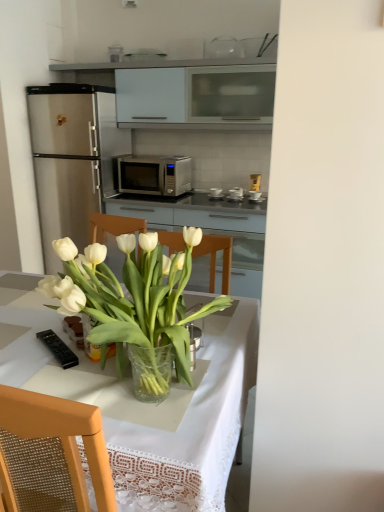
Question: Is black plastic remote control at lower left, which ranks as the 2th appliance in back-to-front order, not close to satin silver microwave at center?

Choices:
 (A) yes
 (B) no

Answer: (A)

Question: Is black plastic remote control at lower left, which ranks as the first appliance in front-to-back order, not within satin silver microwave at center?

Choices:
 (A) yes
 (B) no

Answer: (A)

Question: Can you confirm if black plastic remote control at lower left, acting as the 1th appliance starting from the bottom, is thinner than satin silver microwave at center?

Choices:
 (A) yes
 (B) no

Answer: (A)

Question: Does black plastic remote control at lower left, acting as the second appliance starting from the right, have a smaller size compared to satin silver microwave at center?

Choices:
 (A) no
 (B) yes

Answer: (B)

Question: Considering the relative sizes of black plastic remote control at lower left, which ranks as the first appliance in front-to-back order, and satin silver microwave at center in the image provided, is black plastic remote control at lower left, which ranks as the first appliance in front-to-back order, shorter than satin silver microwave at center?

Choices:
 (A) yes
 (B) no

Answer: (A)

Question: In terms of width, does white matte cabinet at upper center look wider or thinner when compared to metallic silver toaster at center, placed as the first appliance when sorted from back to front?

Choices:
 (A) thin
 (B) wide

Answer: (B)

Question: From a real-world perspective, is white matte cabinet at upper center above or below metallic silver toaster at center, the 1th appliance in the right-to-left sequence?

Choices:
 (A) above
 (B) below

Answer: (A)

Question: In terms of size, does white matte cabinet at upper center appear bigger or smaller than metallic silver toaster at center, arranged as the 1th appliance when viewed from the top?

Choices:
 (A) big
 (B) small

Answer: (A)

Question: Is point (117, 108) closer or farther from the camera than point (236, 188)?

Choices:
 (A) farther
 (B) closer

Answer: (B)

Question: In terms of height, does metallic silver toaster at center, arranged as the second appliance when viewed from the front, look taller or shorter compared to translucent glass vase at center?

Choices:
 (A) tall
 (B) short

Answer: (B)

Question: From a real-world perspective, is metallic silver toaster at center, placed as the first appliance when sorted from back to front, above or below translucent glass vase at center?

Choices:
 (A) below
 (B) above

Answer: (A)

Question: In the image, is metallic silver toaster at center, positioned as the 2th appliance in bottom-to-top order, positioned in front of or behind translucent glass vase at center?

Choices:
 (A) behind
 (B) front

Answer: (A)

Question: Considering the positions of point (236, 187) and point (61, 291), is point (236, 187) closer or farther from the camera than point (61, 291)?

Choices:
 (A) closer
 (B) farther

Answer: (B)

Question: Is point (67, 355) positioned closer to the camera than point (99, 327)?

Choices:
 (A) farther
 (B) closer

Answer: (A)

Question: Is black plastic remote control at lower left, the first appliance viewed from the left, to the left or to the right of translucent glass vase at center in the image?

Choices:
 (A) left
 (B) right

Answer: (A)